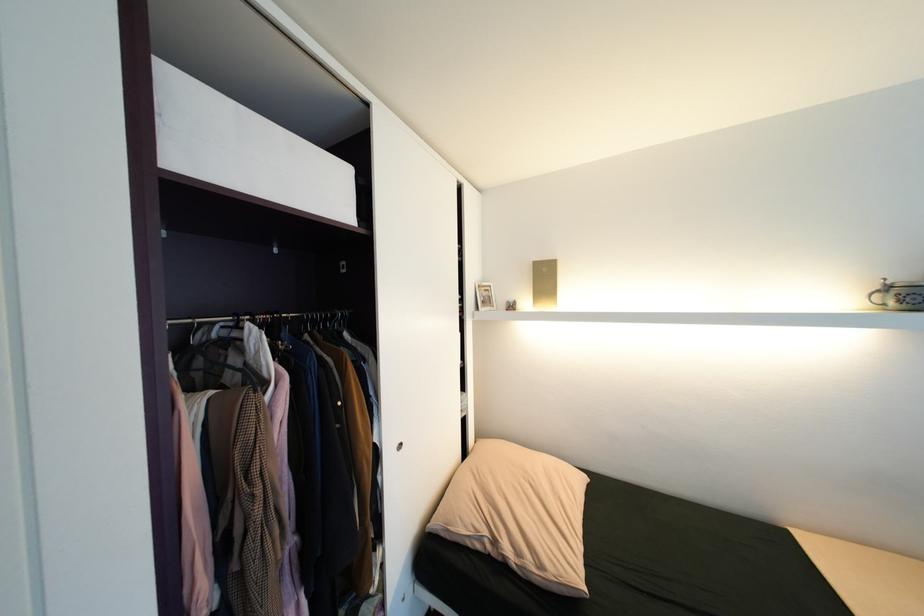
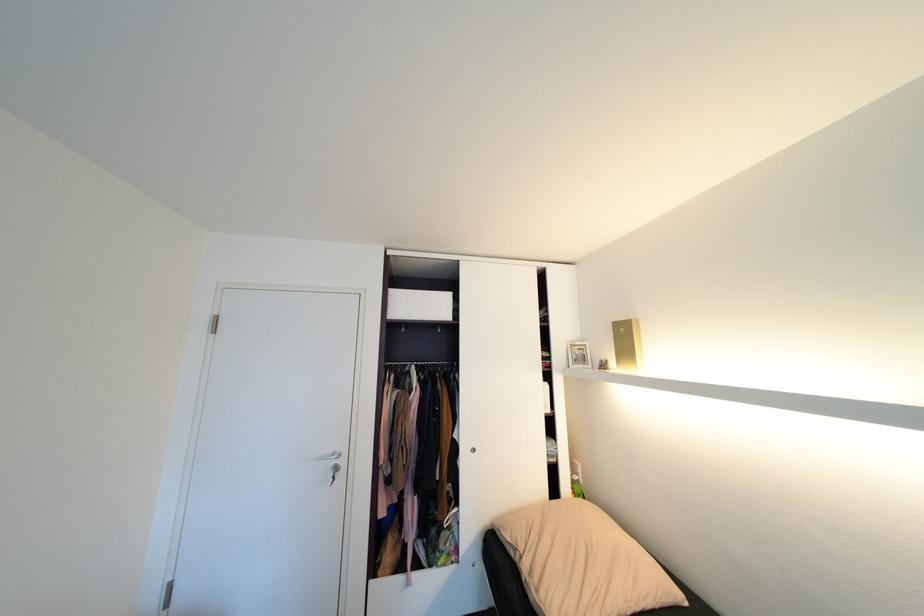
Locate, in the second image, the point that corresponds to (485,546) in the first image.

(518, 554)